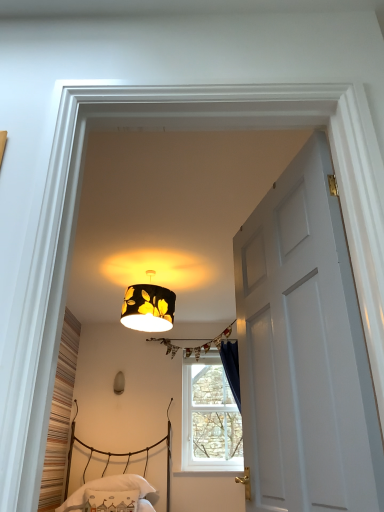
Question: Considering their positions, is white plastic window at center located in front of or behind matte yellow fabric lampshade at upper center, which is the first lamp from back to front?

Choices:
 (A) front
 (B) behind

Answer: (A)

Question: Based on their positions, is white plastic window at center located to the left or right of matte yellow fabric lampshade at upper center, which is counted as the 2th lamp, starting from the right?

Choices:
 (A) left
 (B) right

Answer: (B)

Question: Estimate the real-world distances between objects in this image. Which object is farther from the matte yellow fabric lampshade at upper center, which is the first lamp from bottom to top?

Choices:
 (A) white plastic window at center
 (B) black fabric lampshade at center, the 2th lamp when ordered from bottom to top
 (C) white cotton pillow at lower center
 (D) white fabric pillow at lower center
 (E) white glossy door at center

Answer: (E)

Question: Which of these objects is positioned farthest from the white cotton pillow at lower center?

Choices:
 (A) white glossy door at center
 (B) white fabric pillow at lower center
 (C) white plastic window at center
 (D) black fabric lampshade at center, the 1th lamp positioned from the top
 (E) matte yellow fabric lampshade at upper center, which is the first lamp from bottom to top

Answer: (A)